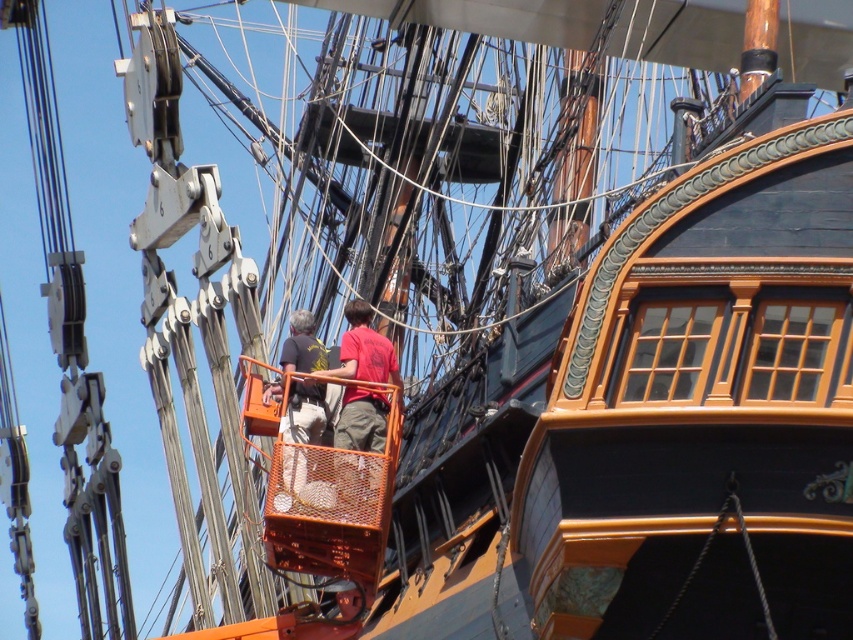
You are a crew member on the historic ship and need to identify clothing details for a safety briefing. Which crew member has a wider shirt, the one wearing the dark gray fabric shirt at center or the red matte shirt at center?

The red matte shirt at center is wider than the dark gray fabric shirt at center.

You are a crew member on the historic ship and need to identify clothing for a task. Which of the following has a larger size between the dark gray fabric shirt at center and the red matte shirt at center?

The dark gray fabric shirt at center is bigger than the red matte shirt at center.

You are a sailor on the historic ship and need to identify the crew member closest to the ship hull. Which crew member is standing lower in relation to the ship hull? The crew members are the dark gray fabric shirt at center and the red matte shirt at center.

The dark gray fabric shirt at center is positioned under the red matte shirt at center, so the dark gray fabric shirt at center is standing lower in relation to the ship hull.